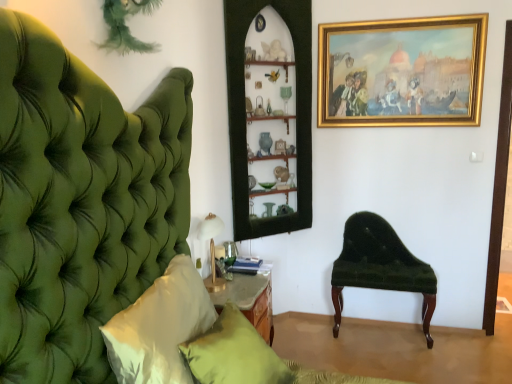
The height and width of the screenshot is (384, 512). I want to click on vacant space underneath velvet green bench at right (from a real-world perspective), so click(379, 336).